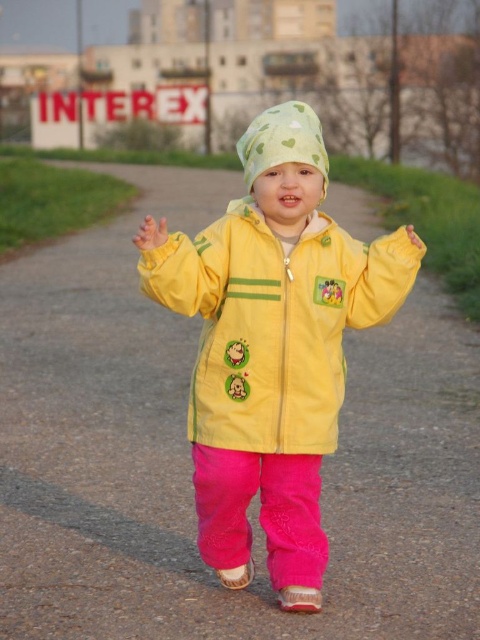
Looking at this image, is yellow matte jacket at center shorter than green fabric hat at center?

No, yellow matte jacket at center is not shorter than green fabric hat at center.

Who is higher up, yellow matte jacket at center or green fabric hat at center?

green fabric hat at center

Does point (240, 380) come closer to viewer compared to point (291, 125)?

No, it is not.

Where is `yellow matte jacket at center`? The width and height of the screenshot is (480, 640). yellow matte jacket at center is located at coordinates (275, 323).